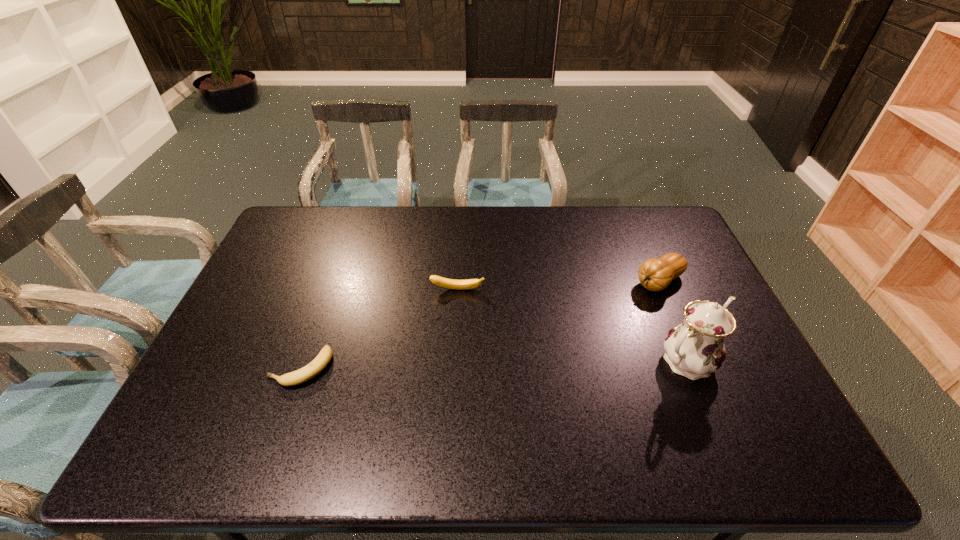
Locate an element on the screen. free region located 0.160m at the stem of the right banana is located at coordinates (456, 333).

Identify the location of vacant space situated 0.200m on the stem side of the gourd. Image resolution: width=960 pixels, height=540 pixels. (596, 319).

Identify the location of vacant area situated 0.140m on the stem side of the gourd. This screenshot has width=960, height=540. click(x=611, y=310).

Identify the location of free spot located 0.350m on the stem side of the gourd. (559, 343).

Find the location of a particular element. object situated at the near edge is located at coordinates (309, 371).

At what (x,y) coordinates should I click in order to perform the action: click on chinaware present at the right edge. Please return your answer as a coordinate pair (x, y). This screenshot has height=540, width=960. Looking at the image, I should click on (695, 348).

This screenshot has height=540, width=960. Identify the location of gourd present at the right edge. (655, 274).

The image size is (960, 540). What are the coordinates of `vacant position at the far edge of the desktop` in the screenshot? It's located at click(x=452, y=210).

In the image, there is a desktop. At what (x,y) coordinates should I click in order to perform the action: click on free space at the near edge. Please return your answer as a coordinate pair (x, y). The width and height of the screenshot is (960, 540). Looking at the image, I should click on (576, 417).

You are a GUI agent. You are given a task and a screenshot of the screen. Output one action in this format:
    pyautogui.click(x=<x>, y=<y>)
    Task: Click on the free space at the left edge of the desktop
    The height and width of the screenshot is (540, 960).
    Given the screenshot: What is the action you would take?
    pyautogui.click(x=248, y=285)